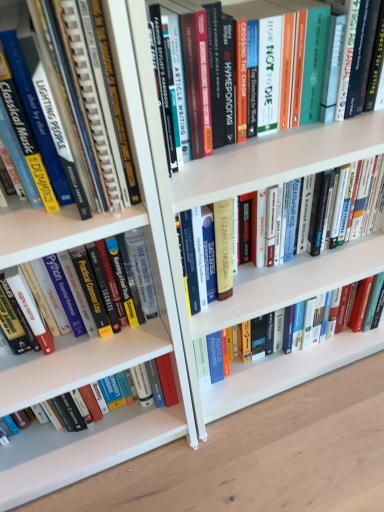
Question: From the image's perspective, is hardcover book at center, marked as the fourth book in a bottom-to-top arrangement, positioned above or below hardcover book at center, acting as the 1th book starting from the top?

Choices:
 (A) below
 (B) above

Answer: (A)

Question: From a real-world perspective, relative to hardcover book at center, acting as the 1th book starting from the top, is hardcover book at center, marked as the fourth book in a bottom-to-top arrangement, vertically above or below?

Choices:
 (A) above
 (B) below

Answer: (B)

Question: Based on their relative distances, which object is farther from the hardcover book at center, which ranks as the fourth book in top-to-bottom order?

Choices:
 (A) hardcover book at lower left, the fifth book viewed from the top
 (B) hardcover book at center, marked as the fourth book in a bottom-to-top arrangement
 (C) hardcover book at left, the 3th book ordered from the bottom
 (D) hardcover book at center, acting as the 1th book starting from the top

Answer: (D)

Question: Estimate the real-world distances between objects in this image. Which object is closer to the hardcover book at center, positioned as the second book in top-to-bottom order?

Choices:
 (A) hardcover book at lower left, the fifth book viewed from the top
 (B) hardcover book at left, which ranks as the 3th book in top-to-bottom order
 (C) hardcover book at center, acting as the 1th book starting from the top
 (D) hardcover book at center, which ranks as the fourth book in top-to-bottom order

Answer: (C)